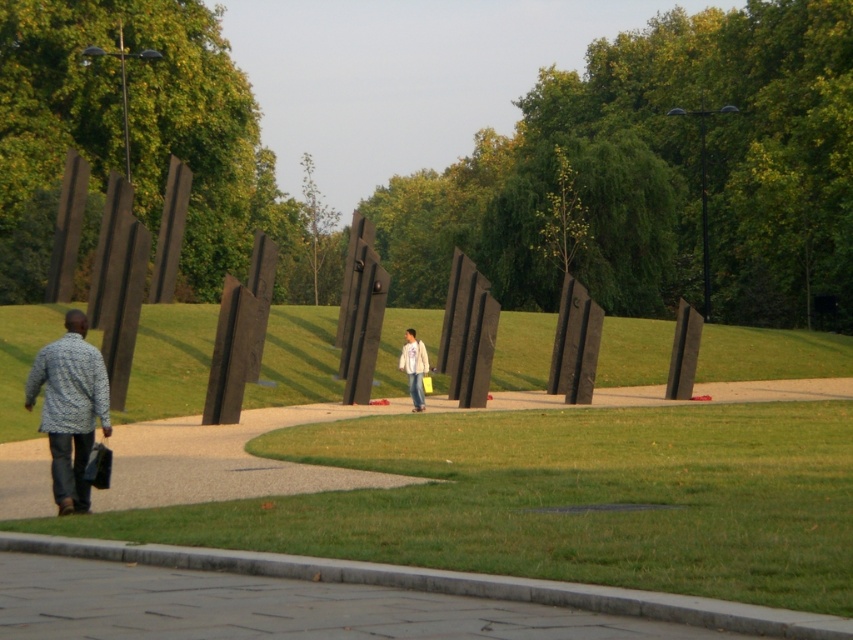
You are standing on the paved walkway and want to reach the white cotton jacket at center. Which direction should you walk to get closer to it, considering the green leafy tree at center is blocking your view?

The white cotton jacket at center is closer to you than the green leafy tree at center, so you should walk forward towards the white cotton jacket at center, as the green leafy tree at center is behind it.

You are a photographer trying to capture both the green leafy tree at center and the patterned fabric shirt at lower left in the same frame. Which object will appear bigger in your photo?

The green leafy tree at center will appear bigger in the photo since it is larger in size than the patterned fabric shirt at lower left.

You are standing at the starting point of the walkway and see two points marked in the image. The first point is at coordinate point (x=569, y=109) and the second point is at coordinate point (x=62, y=348). Which point is closer to you?

Point (x=62, y=348) is closer to you because it is in front of point (x=569, y=109).